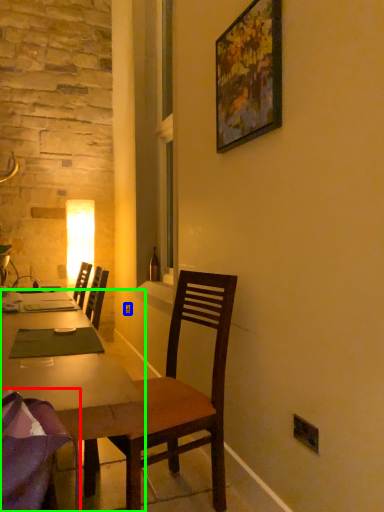
Question: Which object is positioned closest to chair (highlighted by a red box)? Select from power outlet (highlighted by a blue box) and desk (highlighted by a green box).

Choices:
 (A) power outlet
 (B) desk

Answer: (B)